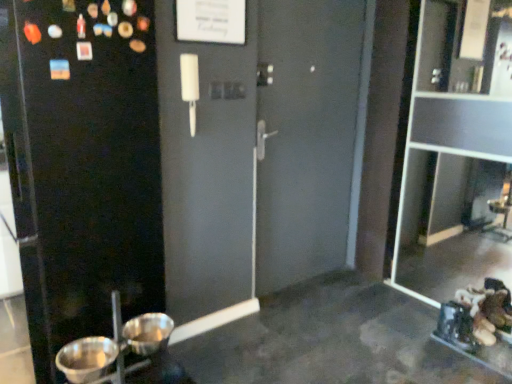
This screenshot has width=512, height=384. What do you see at coordinates (147, 333) in the screenshot?
I see `metallic silver basin at lower left, which ranks as the first basin in right-to-left order` at bounding box center [147, 333].

Describe the element at coordinates (457, 158) in the screenshot. I see `transparent glass cabinet at right` at that location.

Image resolution: width=512 pixels, height=384 pixels. What do you see at coordinates (83, 165) in the screenshot?
I see `black matte screen door at left` at bounding box center [83, 165].

The width and height of the screenshot is (512, 384). I want to click on metallic silver basin at lower left, the first basin positioned from the left, so click(87, 359).

The height and width of the screenshot is (384, 512). Identify the location of metallic silver basin at lower left, which ranks as the first basin in right-to-left order. (147, 333).

Is transparent glass cabinet at right placed right next to black matte screen door at left?

There is a gap between transparent glass cabinet at right and black matte screen door at left.

Is transparent glass cabinet at right facing away from black matte screen door at left?

No.

Visually, is transparent glass cabinet at right positioned to the left or to the right of black matte screen door at left?

transparent glass cabinet at right is to the right of black matte screen door at left.

Based on their positions, is metallic silver basin at lower left, the first basin positioned from the left, located to the left or right of metallic silver basin at lower left, which ranks as the first basin in right-to-left order?

metallic silver basin at lower left, the first basin positioned from the left, is positioned on metallic silver basin at lower left, which ranks as the first basin in right-to-left order,'s left side.

From the image's perspective, is metallic silver basin at lower left, the first basin positioned from the left, below metallic silver basin at lower left, the second basin from the left?

Correct, metallic silver basin at lower left, the first basin positioned from the left, appears lower than metallic silver basin at lower left, the second basin from the left, in the image.

Is metallic silver basin at lower left, the first basin positioned from the left, located outside metallic silver basin at lower left, which ranks as the first basin in right-to-left order?

Yes, metallic silver basin at lower left, the first basin positioned from the left, is outside of metallic silver basin at lower left, which ranks as the first basin in right-to-left order.

Would you consider black matte screen door at left to be distant from metallic silver basin at lower left, which ranks as the first basin in right-to-left order?

black matte screen door at left is near metallic silver basin at lower left, which ranks as the first basin in right-to-left order, not far away.

In the scene shown: What's the angular difference between black matte screen door at left and metallic silver basin at lower left, the second basin from the left,'s facing directions?

They differ by 91.9 degrees in their facing directions.

How much distance is there between black matte screen door at left and metallic silver basin at lower left, which ranks as the first basin in right-to-left order?

The distance of black matte screen door at left from metallic silver basin at lower left, which ranks as the first basin in right-to-left order, is 24.09 inches.

From a real-world perspective, is black matte screen door at left above or below metallic silver basin at lower left, which ranks as the first basin in right-to-left order?

From a real-world perspective, black matte screen door at left is physically above metallic silver basin at lower left, which ranks as the first basin in right-to-left order.

Is black matte screen door at left completely or partially inside metallic silver basin at lower left, the first basin positioned from the left?

No, metallic silver basin at lower left, the first basin positioned from the left, does not contain black matte screen door at left.

Is metallic silver basin at lower left, the first basin positioned from the left, positioned far away from black matte screen door at left?

metallic silver basin at lower left, the first basin positioned from the left, is near black matte screen door at left, not far away.

Locate an element on the screen. This screenshot has width=512, height=384. screen door above the metallic silver basin at lower left, the first basin positioned from the left (from the image's perspective) is located at coordinates (83, 165).

Does point (81, 374) appear closer or farther from the camera than point (125, 166)?

Point (81, 374) is positioned farther from the camera compared to point (125, 166).

Is black matte screen door at left positioned with its back to metallic silver basin at lower left, which appears as the second basin when viewed from the right?

No, metallic silver basin at lower left, which appears as the second basin when viewed from the right, is not at the back of black matte screen door at left.

In the image, is black matte screen door at left positioned in front of or behind metallic silver basin at lower left, the first basin positioned from the left?

Clearly, black matte screen door at left is in front of metallic silver basin at lower left, the first basin positioned from the left.

Is black matte screen door at left wider or thinner than metallic silver basin at lower left, the first basin positioned from the left?

Clearly, black matte screen door at left has more width compared to metallic silver basin at lower left, the first basin positioned from the left.

Considering the points (116, 270) and (97, 353), which point is behind, point (116, 270) or point (97, 353)?

Point (116, 270)

From a real-world perspective, who is located higher, metallic silver basin at lower left, which appears as the second basin when viewed from the right, or transparent glass cabinet at right?

In real-world perspective, transparent glass cabinet at right is above.

Consider the image. Looking at their sizes, would you say metallic silver basin at lower left, which appears as the second basin when viewed from the right, is wider or thinner than transparent glass cabinet at right?

In the image, metallic silver basin at lower left, which appears as the second basin when viewed from the right, appears to be wider than transparent glass cabinet at right.

I want to click on glass door behind the metallic silver basin at lower left, which appears as the second basin when viewed from the right, so click(x=457, y=158).

Is metallic silver basin at lower left, the first basin positioned from the left, aimed at transparent glass cabinet at right?

No, metallic silver basin at lower left, the first basin positioned from the left, is not turned towards transparent glass cabinet at right.

Is transparent glass cabinet at right inside the boundaries of metallic silver basin at lower left, which ranks as the first basin in right-to-left order, or outside?

transparent glass cabinet at right is not enclosed by metallic silver basin at lower left, which ranks as the first basin in right-to-left order.

Does transparent glass cabinet at right have a lesser height compared to metallic silver basin at lower left, which ranks as the first basin in right-to-left order?

No.

Which is closer, (458, 95) or (124, 345)?

Point (124, 345)

Looking at this image, does transparent glass cabinet at right appear on the left side of metallic silver basin at lower left, the second basin from the left?

Incorrect, transparent glass cabinet at right is not on the left side of metallic silver basin at lower left, the second basin from the left.

I want to click on glass door located above the black matte screen door at left (from the image's perspective), so click(x=457, y=158).

This screenshot has width=512, height=384. Identify the location of basin below the metallic silver basin at lower left, the second basin from the left (from the image's perspective). (87, 359).

Based on the photo, which object lies nearer to the anchor point transparent glass cabinet at right, metallic silver basin at lower left, which appears as the second basin when viewed from the right, or black matte screen door at left?

Based on the image, black matte screen door at left appears to be nearer to transparent glass cabinet at right.

Which object lies nearer to the anchor point black matte screen door at left, transparent glass cabinet at right or metallic silver basin at lower left, which ranks as the first basin in right-to-left order?

metallic silver basin at lower left, which ranks as the first basin in right-to-left order, is positioned closer to the anchor black matte screen door at left.

Looking at the image, which one is located further to black matte screen door at left, metallic silver basin at lower left, the first basin positioned from the left, or transparent glass cabinet at right?

Among the two, transparent glass cabinet at right is located further to black matte screen door at left.

Which object lies nearer to the anchor point black matte screen door at left, metallic silver basin at lower left, the second basin from the left, or metallic silver basin at lower left, the first basin positioned from the left?

metallic silver basin at lower left, the first basin positioned from the left, is closer to black matte screen door at left.

In the scene shown: Estimate the real-world distances between objects in this image. Which object is further from transparent glass cabinet at right, black matte screen door at left or metallic silver basin at lower left, which appears as the second basin when viewed from the right?

Based on the image, metallic silver basin at lower left, which appears as the second basin when viewed from the right, appears to be further to transparent glass cabinet at right.

Based on their spatial positions, is transparent glass cabinet at right or black matte screen door at left closer to metallic silver basin at lower left, the second basin from the left?

black matte screen door at left.

Based on their spatial positions, is metallic silver basin at lower left, the first basin positioned from the left, or metallic silver basin at lower left, which ranks as the first basin in right-to-left order, further from black matte screen door at left?

metallic silver basin at lower left, which ranks as the first basin in right-to-left order, is further to black matte screen door at left.

From the image, which object appears to be farther from metallic silver basin at lower left, which appears as the second basin when viewed from the right, metallic silver basin at lower left, the second basin from the left, or transparent glass cabinet at right?

transparent glass cabinet at right is positioned further to the anchor metallic silver basin at lower left, which appears as the second basin when viewed from the right.

At what (x,y) coordinates should I click in order to perform the action: click on basin between black matte screen door at left and metallic silver basin at lower left, which appears as the second basin when viewed from the right, vertically. Please return your answer as a coordinate pair (x, y). Looking at the image, I should click on (147, 333).

Find the location of `basin between metallic silver basin at lower left, the first basin positioned from the left, and transparent glass cabinet at right from left to right`. basin between metallic silver basin at lower left, the first basin positioned from the left, and transparent glass cabinet at right from left to right is located at coordinates (147, 333).